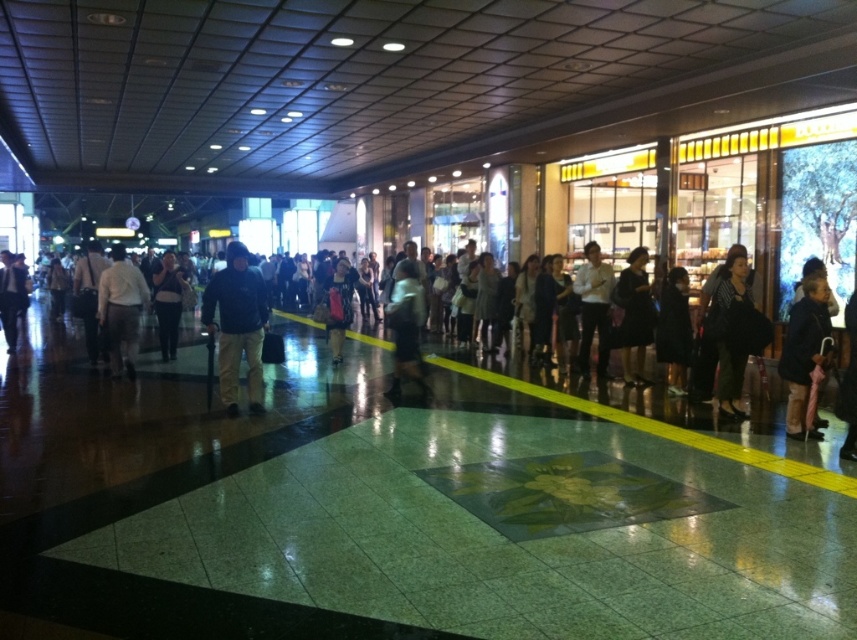
Which of these two, dark blue fabric at center or white matte shirt at center, stands taller?

Standing taller between the two is white matte shirt at center.

Is point (253, 397) positioned behind point (584, 301)?

No, (253, 397) is closer to viewer.

The image size is (857, 640). I want to click on dark blue fabric at center, so [237, 324].

How far apart are dark gray fabric coat at center and light gray fabric jacket at center?

dark gray fabric coat at center is 8.62 feet from light gray fabric jacket at center.

Does point (634, 372) lie behind point (418, 349)?

No, it is not.

Locate an element on the screen. dark gray fabric coat at center is located at coordinates (634, 316).

Is point (824, 273) positioned in front of point (421, 296)?

Yes, point (824, 273) is closer to viewer.

What do you see at coordinates (805, 353) in the screenshot?
I see `dark brown leather jacket at right` at bounding box center [805, 353].

At what (x,y) coordinates should I click in order to perform the action: click on dark brown leather jacket at right. Please return your answer as a coordinate pair (x, y). This screenshot has height=640, width=857. Looking at the image, I should click on (805, 353).